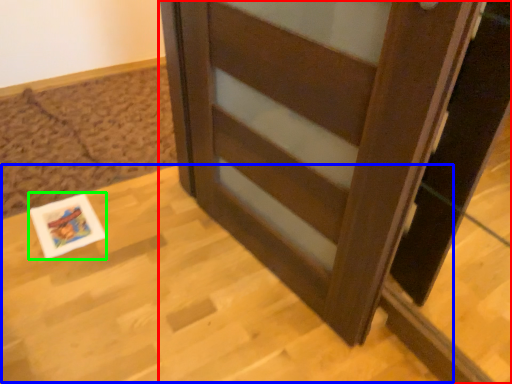
Question: Which is farther away from furniture (highlighted by a red box)? table (highlighted by a blue box) or postcard (highlighted by a green box)?

Choices:
 (A) table
 (B) postcard

Answer: (B)